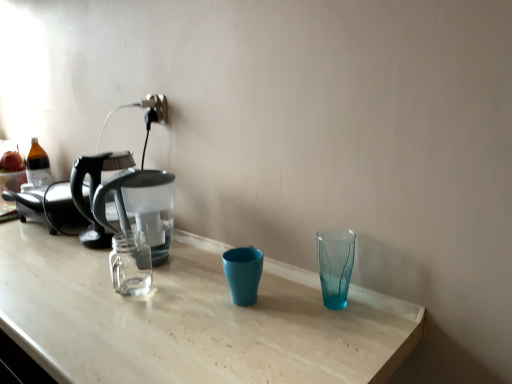
What do you see at coordinates (335, 265) in the screenshot? I see `transparent glass shot glass at right` at bounding box center [335, 265].

In order to click on transparent glass shot glass at right in this screenshot , I will do `click(335, 265)`.

This screenshot has height=384, width=512. What do you see at coordinates (94, 191) in the screenshot?
I see `transparent plastic coffee maker at left` at bounding box center [94, 191].

Where is `transparent plastic coffee maker at left`? This screenshot has height=384, width=512. transparent plastic coffee maker at left is located at coordinates (94, 191).

Image resolution: width=512 pixels, height=384 pixels. What are the coordinates of `transparent glass shot glass at right` in the screenshot? It's located at (335, 265).

Considering the positions of objects transparent plastic coffee maker at left and transparent glass shot glass at right in the image provided, who is more to the left, transparent plastic coffee maker at left or transparent glass shot glass at right?

transparent plastic coffee maker at left is more to the left.

Is transparent plastic coffee maker at left further to camera compared to transparent glass shot glass at right?

Yes, it is behind transparent glass shot glass at right.

Is point (172, 221) less distant than point (344, 291)?

No, it is behind (344, 291).

From the image's perspective, is transparent plastic coffee maker at left above or below transparent glass shot glass at right?

transparent plastic coffee maker at left is situated higher than transparent glass shot glass at right in the image.

From a real-world perspective, which object rests below the other?

In real-world perspective, transparent glass shot glass at right is lower.

Consider the image. Is transparent plastic coffee maker at left wider or thinner than transparent glass shot glass at right?

Clearly, transparent plastic coffee maker at left has more width compared to transparent glass shot glass at right.

Does transparent plastic coffee maker at left have a greater height compared to transparent glass shot glass at right?

Correct, transparent plastic coffee maker at left is much taller as transparent glass shot glass at right.

Based on their sizes in the image, would you say transparent plastic coffee maker at left is bigger or smaller than transparent glass shot glass at right?

Clearly, transparent plastic coffee maker at left is larger in size than transparent glass shot glass at right.

Which is correct: transparent plastic coffee maker at left is inside transparent glass shot glass at right, or outside of it?

transparent plastic coffee maker at left lies outside transparent glass shot glass at right.

Is transparent plastic coffee maker at left next to transparent glass shot glass at right and touching it?

No, transparent plastic coffee maker at left is not beside transparent glass shot glass at right.

Is transparent glass shot glass at right at the back of transparent plastic coffee maker at left?

That's not correct — transparent plastic coffee maker at left is not looking away from transparent glass shot glass at right.

What's the angular difference between transparent plastic coffee maker at left and transparent glass shot glass at right's facing directions?

0.00593 degrees.

At what (x,y) coordinates should I click in order to perform the action: click on shot glass in front of the transparent plastic coffee maker at left. Please return your answer as a coordinate pair (x, y). Looking at the image, I should click on (335, 265).

Does transparent glass shot glass at right appear on the left side of transparent plastic coffee maker at left?

In fact, transparent glass shot glass at right is to the right of transparent plastic coffee maker at left.

Considering the relative positions of transparent glass shot glass at right and transparent plastic coffee maker at left in the image provided, is transparent glass shot glass at right in front of transparent plastic coffee maker at left?

Yes, transparent glass shot glass at right is closer to the camera.

Considering the positions of point (349, 255) and point (122, 167), is point (349, 255) closer or farther from the camera than point (122, 167)?

Point (349, 255) is positioned closer to the camera compared to point (122, 167).

From the image's perspective, between transparent glass shot glass at right and transparent plastic coffee maker at left, which one is located above?

transparent plastic coffee maker at left appears higher in the image.

From a real-world perspective, who is located higher, transparent glass shot glass at right or transparent plastic coffee maker at left?

transparent plastic coffee maker at left, from a real-world perspective.

Is transparent glass shot glass at right thinner than transparent plastic coffee maker at left?

Indeed, transparent glass shot glass at right has a lesser width compared to transparent plastic coffee maker at left.

Is transparent glass shot glass at right shorter than transparent plastic coffee maker at left?

Indeed, transparent glass shot glass at right has a lesser height compared to transparent plastic coffee maker at left.

Is transparent glass shot glass at right bigger than transparent plastic coffee maker at left?

Actually, transparent glass shot glass at right might be smaller than transparent plastic coffee maker at left.

Would you say transparent glass shot glass at right is outside transparent plastic coffee maker at left?

Yes, transparent glass shot glass at right is outside of transparent plastic coffee maker at left.

Would you say transparent glass shot glass at right is a long distance from transparent plastic coffee maker at left?

transparent glass shot glass at right is near transparent plastic coffee maker at left, not far away.

Is transparent glass shot glass at right facing away from transparent plastic coffee maker at left?

No, transparent glass shot glass at right's orientation is not away from transparent plastic coffee maker at left.

The width and height of the screenshot is (512, 384). In order to click on coffee maker on the left of transparent glass shot glass at right in this screenshot , I will do `click(94, 191)`.

At what (x,y) coordinates should I click in order to perform the action: click on shot glass lying on the right of transparent plastic coffee maker at left. Please return your answer as a coordinate pair (x, y). Looking at the image, I should click on (335, 265).

This screenshot has height=384, width=512. Identify the location of coffee maker above the transparent glass shot glass at right (from the image's perspective). (94, 191).